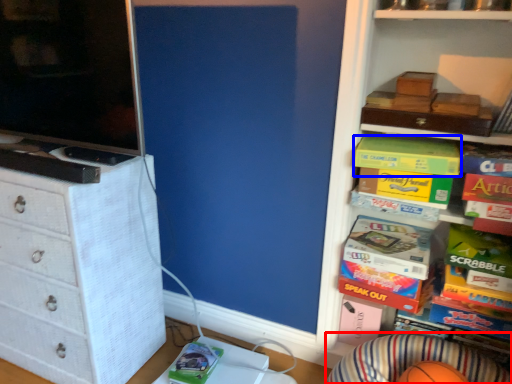
Question: Which object appears farthest to the camera in this image, plain (highlighted by a red box) or book (highlighted by a blue box)?

Choices:
 (A) plain
 (B) book

Answer: (B)